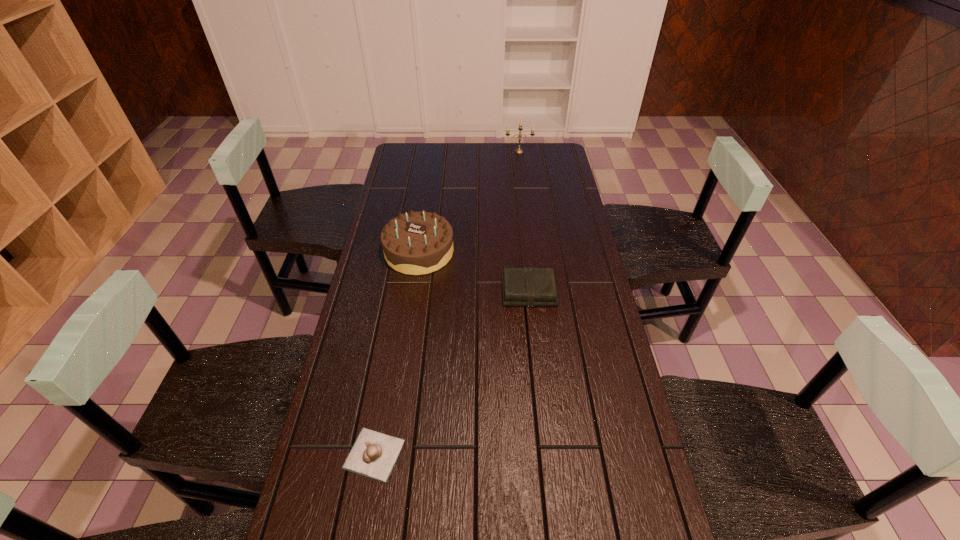
Where is `vacant region between the third farthest object and the third shortest object`? vacant region between the third farthest object and the third shortest object is located at coordinates (474, 272).

The width and height of the screenshot is (960, 540). I want to click on vacant space in between the book and the garlic, so click(x=451, y=373).

Identify the location of object that is the second closest to the candle. (528, 286).

Locate which object is the closest to the second shortest object. Please provide its 2D coordinates. Your answer should be formatted as a tuple, i.e. [(x, y)], where the tuple contains the x and y coordinates of a point satisfying the conditions above.

[(416, 243)]

Where is `free location that satisfies the following two spatial constraints: 1. on the front-facing side of the birthday cake; 2. on the left side of the third farthest object`? The image size is (960, 540). free location that satisfies the following two spatial constraints: 1. on the front-facing side of the birthday cake; 2. on the left side of the third farthest object is located at coordinates (413, 292).

Where is `free space that satisfies the following two spatial constraints: 1. on the back side of the farthest object; 2. on the left side of the third tallest object`? free space that satisfies the following two spatial constraints: 1. on the back side of the farthest object; 2. on the left side of the third tallest object is located at coordinates (514, 151).

The width and height of the screenshot is (960, 540). I want to click on free space that satisfies the following two spatial constraints: 1. on the front-facing side of the second farthest object; 2. on the left side of the book, so click(413, 292).

At what (x,y) coordinates should I click in order to perform the action: click on free space that satisfies the following two spatial constraints: 1. on the front-facing side of the second farthest object; 2. on the right side of the second shortest object. Please return your answer as a coordinate pair (x, y). This screenshot has height=540, width=960. Looking at the image, I should click on coord(413,292).

Find the location of `free location that satisfies the following two spatial constraints: 1. on the front-facing side of the third nearest object; 2. on the left side of the second shortest object`. free location that satisfies the following two spatial constraints: 1. on the front-facing side of the third nearest object; 2. on the left side of the second shortest object is located at coordinates (413, 292).

The height and width of the screenshot is (540, 960). What are the coordinates of `vacant space that satisfies the following two spatial constraints: 1. on the back side of the farthest object; 2. on the left side of the second shortest object` in the screenshot? It's located at pyautogui.click(x=514, y=151).